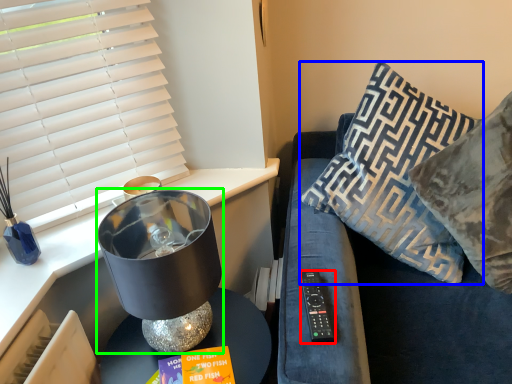
Question: Based on their relative distances, which object is farther from remote (highlighted by a red box)? Choose from pillow (highlighted by a blue box) and table lamp (highlighted by a green box).

Choices:
 (A) pillow
 (B) table lamp

Answer: (A)